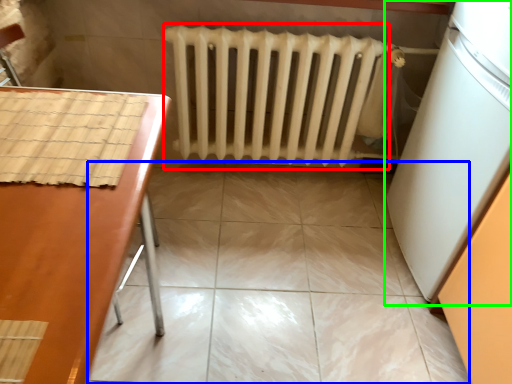
Question: Which object is the closest to the radiator (highlighted by a red box)? Choose among these: ceramic tile (highlighted by a blue box) or appliance (highlighted by a green box).

Choices:
 (A) ceramic tile
 (B) appliance

Answer: (A)